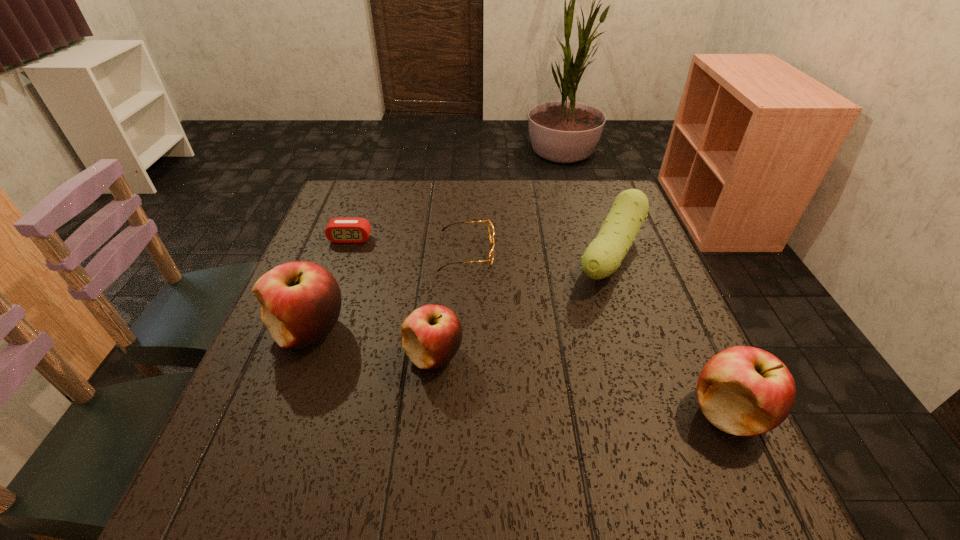
Where is `the leftmost apple`? This screenshot has height=540, width=960. the leftmost apple is located at coordinates (300, 301).

The height and width of the screenshot is (540, 960). In order to click on the shortest apple in this screenshot , I will do `click(431, 335)`.

The width and height of the screenshot is (960, 540). I want to click on the second tallest apple, so click(x=744, y=391).

The image size is (960, 540). I want to click on the fifth shortest object, so click(x=744, y=391).

In order to click on spectacles in this screenshot , I will do `click(490, 226)`.

Locate an element on the screen. The width and height of the screenshot is (960, 540). cucumber is located at coordinates (603, 256).

This screenshot has height=540, width=960. What are the coordinates of `alarm clock` in the screenshot? It's located at (339, 230).

Locate an element on the screen. Image resolution: width=960 pixels, height=540 pixels. free space located 0.370m on the back of the leftmost apple is located at coordinates (353, 212).

Find the location of a particular element. This screenshot has width=960, height=540. free space located 0.170m on the right of the second apple from left to right is located at coordinates (547, 355).

You are a GUI agent. You are given a task and a screenshot of the screen. Output one action in this format:
    pyautogui.click(x=<x>, y=<y>)
    Task: Click on the blank space located on the back of the rightmost apple
    
    Given the screenshot: What is the action you would take?
    pyautogui.click(x=693, y=336)